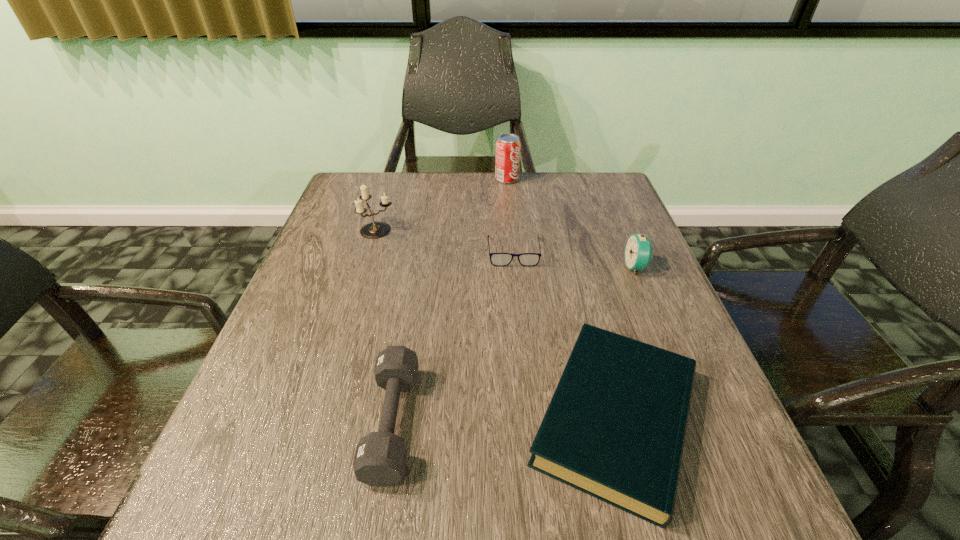
Locate an element on the screen. free space between the candle holder and the book is located at coordinates pos(496,324).

This screenshot has width=960, height=540. In order to click on free space between the dumbbell and the spectacles in this screenshot , I will do `click(453, 337)`.

Identify the location of vacant area that lies between the candle holder and the third tallest object. The image size is (960, 540). [507, 248].

Locate an element on the screen. unoccupied area between the fourth shortest object and the soda can is located at coordinates (571, 223).

Locate an element on the screen. vacant point located between the dumbbell and the second shortest object is located at coordinates (504, 420).

At what (x,y) coordinates should I click in order to perform the action: click on unoccupied position between the book and the leftmost object. Please return your answer as a coordinate pair (x, y). The width and height of the screenshot is (960, 540). Looking at the image, I should click on (496, 324).

Find the location of a particular element. The width and height of the screenshot is (960, 540). free space between the fourth shortest object and the third shortest object is located at coordinates (515, 345).

Locate an element on the screen. The width and height of the screenshot is (960, 540). unoccupied position between the alarm clock and the leftmost object is located at coordinates (507, 248).

What are the coordinates of `vacant area that lies between the fourth shortest object and the shortest object` in the screenshot? It's located at (575, 259).

Image resolution: width=960 pixels, height=540 pixels. In order to click on the fifth closest object to the second shortest object in this screenshot , I will do [x=507, y=160].